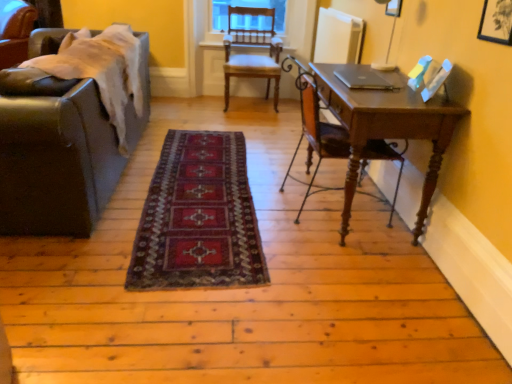
What is the approximate width of dark red woven rug at center?

dark red woven rug at center is 2.22 meters in width.

Locate an element on the screen. wooden desk at right is located at coordinates (388, 127).

What do you see at coordinates (388, 127) in the screenshot?
I see `wooden desk at right` at bounding box center [388, 127].

Where is `wooden chair at center, which is the 2th chair in right-to-left order`? wooden chair at center, which is the 2th chair in right-to-left order is located at coordinates (252, 46).

What are the coordinates of `leather couch at left, which is counted as the 3th chair, starting from the front` in the screenshot? It's located at (15, 31).

Is the position of wooden desk at right more distant than that of leather couch at left, the third chair positioned from the right?

No, wooden desk at right is in front of leather couch at left, the third chair positioned from the right.

Is leather couch at left, the third chair positioned from the right, a part of wooden desk at right?

That's incorrect, leather couch at left, the third chair positioned from the right, is not inside wooden desk at right.

Considering the relative positions of wooden desk at right and leather couch at left, which is counted as the 3th chair, starting from the front, in the image provided, is wooden desk at right to the left or to the right of leather couch at left, which is counted as the 3th chair, starting from the front,?

From the image, it's evident that wooden desk at right is to the right of leather couch at left, which is counted as the 3th chair, starting from the front.

From a real-world perspective, who is located lower, wooden desk at right or dark red woven rug at center?

dark red woven rug at center, from a real-world perspective.

Which object is positioned more to the left, wooden desk at right or dark red woven rug at center?

dark red woven rug at center is more to the left.

Considering the relative sizes of wooden desk at right and dark red woven rug at center in the image provided, is wooden desk at right bigger than dark red woven rug at center?

Yes.

From the image's perspective, relative to dark red woven rug at center, is wooden desk at right above or below?

wooden desk at right is above dark red woven rug at center.

From a real-world perspective, which object rests below the other?

In real-world perspective, wooden desk at right is lower.

The image size is (512, 384). I want to click on chair that is the 2nd one when counting backward from the wooden desk at right, so click(x=252, y=46).

How different are the orientations of wooden chair at center, the 2th chair when ordered from left to right, and wooden desk at right in degrees?

The angular difference between wooden chair at center, the 2th chair when ordered from left to right, and wooden desk at right is 88.1 degrees.

Which is in front, wooden chair at center, the 2th chair when ordered from left to right, or wooden desk at right?

wooden desk at right.

Is wooden chair at center, which is the 2th chair in right-to-left order, oriented away from dark red woven rug at center?

No, wooden chair at center, which is the 2th chair in right-to-left order, is not facing away from dark red woven rug at center.

Considering the positions of objects wooden chair at center, the 2th chair when ordered from left to right, and dark red woven rug at center in the image provided, who is more to the right, wooden chair at center, the 2th chair when ordered from left to right, or dark red woven rug at center?

wooden chair at center, the 2th chair when ordered from left to right.

Does wooden chair at center, the second chair viewed from the back, have a lesser height compared to dark red woven rug at center?

No.

What's the angular difference between wooden chair at center, which is the 2th chair in right-to-left order, and dark red woven rug at center's facing directions?

1.57 degrees.

Does leather couch at left have a lesser height compared to leather couch at left, the third chair positioned from the right?

In fact, leather couch at left may be taller than leather couch at left, the third chair positioned from the right.

In terms of width, does leather couch at left look wider or thinner when compared to leather couch at left, marked as the first chair in a left-to-right arrangement?

Clearly, leather couch at left has more width compared to leather couch at left, marked as the first chair in a left-to-right arrangement.

From the image's perspective, is leather couch at left above or below leather couch at left, the third chair positioned from the right?

leather couch at left is below leather couch at left, the third chair positioned from the right.

Could you tell me if leather couch at left, the third chair positioned from the right, is facing wooden desk at right?

No.

Is leather couch at left, which is counted as the 3th chair, starting from the front, further to camera compared to wooden desk at right?

That is True.

Is leather couch at left, which appears as the first chair when viewed from the back, positioned beyond the bounds of wooden desk at right?

Yes, leather couch at left, which appears as the first chair when viewed from the back, is located beyond the bounds of wooden desk at right.

What's the angular difference between dark red woven rug at center and leather couch at left's facing directions?

91.4 degrees separate the facing orientations of dark red woven rug at center and leather couch at left.

You are a GUI agent. You are given a task and a screenshot of the screen. Output one action in this format:
    pyautogui.click(x=<x>, y=<y>)
    Task: Click on the mat located on the right of leather couch at left
    This screenshot has width=512, height=384.
    Given the screenshot: What is the action you would take?
    pyautogui.click(x=198, y=217)

Is dark red woven rug at center oriented towards leather couch at left?

No.

Considering the relative positions of dark red woven rug at center and leather couch at left in the image provided, is dark red woven rug at center behind leather couch at left?

That is True.

This screenshot has height=384, width=512. Find the location of `table located in front of the leather couch at left, which is counted as the 3th chair, starting from the front`. table located in front of the leather couch at left, which is counted as the 3th chair, starting from the front is located at coordinates (388, 127).

At what (x,y) coordinates should I click in order to perform the action: click on table above the dark red woven rug at center (from the image's perspective). Please return your answer as a coordinate pair (x, y). Looking at the image, I should click on (388, 127).

Estimate the real-world distances between objects in this image. Which object is further from wooden desk at right, leather couch at left or sleek silver laptop at center?

The object further to wooden desk at right is leather couch at left.

Looking at the image, which one is located closer to leather couch at left, marked as the first chair in a left-to-right arrangement, wooden chair at right, marked as the third chair in a back-to-front arrangement, or leather couch at left?

leather couch at left is positioned closer to the anchor leather couch at left, marked as the first chair in a left-to-right arrangement.

When comparing their distances from leather couch at left, does wooden chair at right, marked as the third chair in a back-to-front arrangement, or dark red woven rug at center seem further?

Based on the image, wooden chair at right, marked as the third chair in a back-to-front arrangement, appears to be further to leather couch at left.

Considering their positions, is sleek silver laptop at center positioned further to wooden chair at center, the 2th chair when ordered from left to right, than dark red woven rug at center?

The object further to wooden chair at center, the 2th chair when ordered from left to right, is sleek silver laptop at center.

Looking at the image, which one is located further to dark red woven rug at center, leather couch at left, marked as the first chair in a left-to-right arrangement, or sleek silver laptop at center?

leather couch at left, marked as the first chair in a left-to-right arrangement, is further to dark red woven rug at center.

When comparing their distances from leather couch at left, does leather couch at left, marked as the first chair in a left-to-right arrangement, or dark red woven rug at center seem closer?

dark red woven rug at center lies closer to leather couch at left than the other object.

When comparing their distances from dark red woven rug at center, does sleek silver laptop at center or wooden chair at right, arranged as the 3th chair when viewed from the left, seem closer?

The object closer to dark red woven rug at center is wooden chair at right, arranged as the 3th chair when viewed from the left.

From the image, which object appears to be farther from wooden desk at right, dark red woven rug at center or leather couch at left?

Based on the image, leather couch at left appears to be further to wooden desk at right.

Find the location of a particular element. chair situated between leather couch at left, which appears as the first chair when viewed from the back, and wooden chair at right, arranged as the 3th chair when viewed from the left, from left to right is located at coordinates (252, 46).

This screenshot has height=384, width=512. What are the coordinates of `chair between leather couch at left and wooden chair at center, which appears as the 2th chair when viewed from the front, in the front-back direction` in the screenshot? It's located at (317, 135).

I want to click on chair positioned between dark red woven rug at center and wooden chair at center, which appears as the 2th chair when viewed from the front, from near to far, so click(317, 135).

At what (x,y) coordinates should I click in order to perform the action: click on mat between leather couch at left, which is counted as the 3th chair, starting from the front, and wooden chair at right, marked as the 1th chair in a right-to-left arrangement, from left to right. Please return your answer as a coordinate pair (x, y). Looking at the image, I should click on (198, 217).